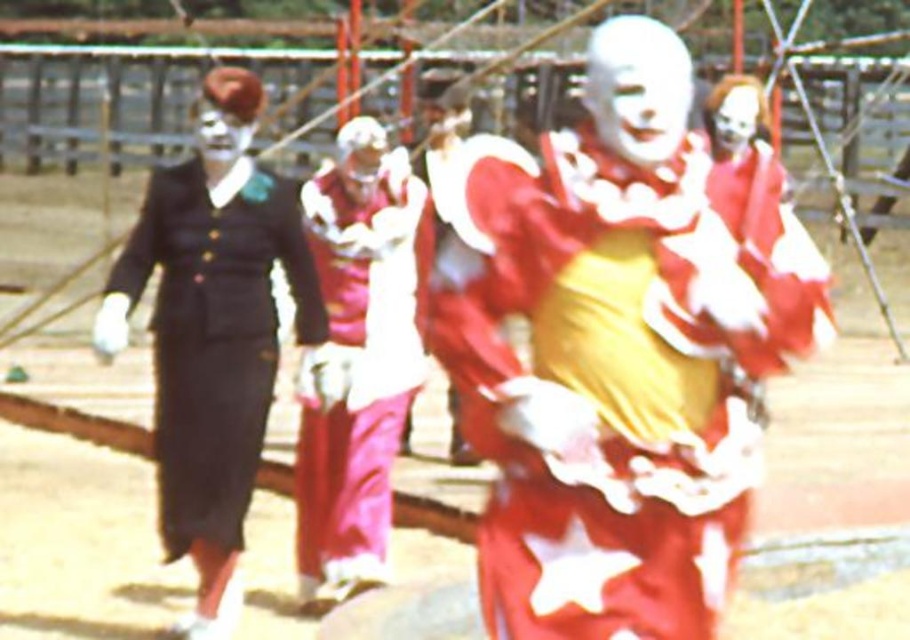
Question: Which of the following is the closest to the observer?

Choices:
 (A) [240, 122]
 (B) [413, 266]
 (C) [678, 109]
 (D) [490, 280]

Answer: (D)

Question: Which point appears farthest from the camera in this image?

Choices:
 (A) (349, 438)
 (B) (534, 632)

Answer: (A)

Question: Does matte black suit at left have a greater width compared to shiny red clown costume at center?

Choices:
 (A) yes
 (B) no

Answer: (A)

Question: Is white matte clown face at center positioned in front of white matte face at upper center?

Choices:
 (A) yes
 (B) no

Answer: (B)

Question: Is matte black suit at left to the right of white matte mask at center from the viewer's perspective?

Choices:
 (A) no
 (B) yes

Answer: (A)

Question: Which point is farther from the camera taking this photo?

Choices:
 (A) (497, 440)
 (B) (742, 138)
 (C) (196, 176)
 (D) (230, 134)

Answer: (B)